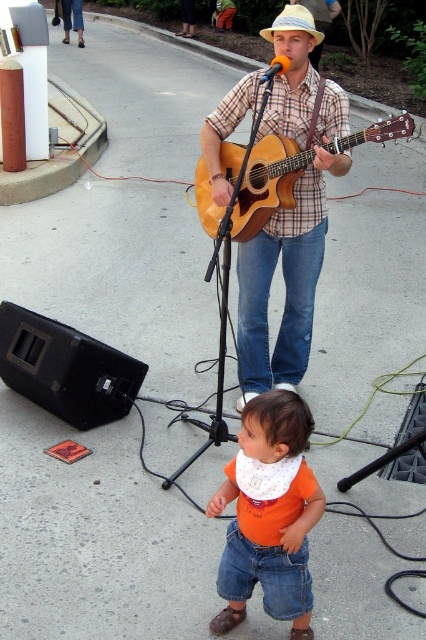
You are a photographer trying to capture the perfect shot of the plaid shirt at center and the light beige straw cowboy hat at center. Since you want to highlight their widths, which object should you focus on to emphasize its thinner appearance?

The plaid shirt at center is thinner than the light beige straw cowboy hat at center, so focusing on the plaid shirt at center will emphasize its thinner appearance.

You are a stagehand setting up for a small outdoor performance. You need to place a stand for the acoustic wood guitar at center and another for the orange matte microphone at upper center. Which stand should be taller to accommodate the taller object?

The orange matte microphone at upper center is taller than the acoustic wood guitar at center, so the stand for the orange matte microphone at upper center should be taller.

You are a photographer capturing this scene. You need to ensure both the orange cotton shirt at lower center and the acoustic wood guitar at center are in focus. Which object should you adjust your camera focus to first to ensure proper alignment?

The orange cotton shirt at lower center is positioned on the left side of the acoustic wood guitar at center, so you should focus on the acoustic wood guitar at center first since it is closer to the center of the image, making it easier to align both objects in focus.